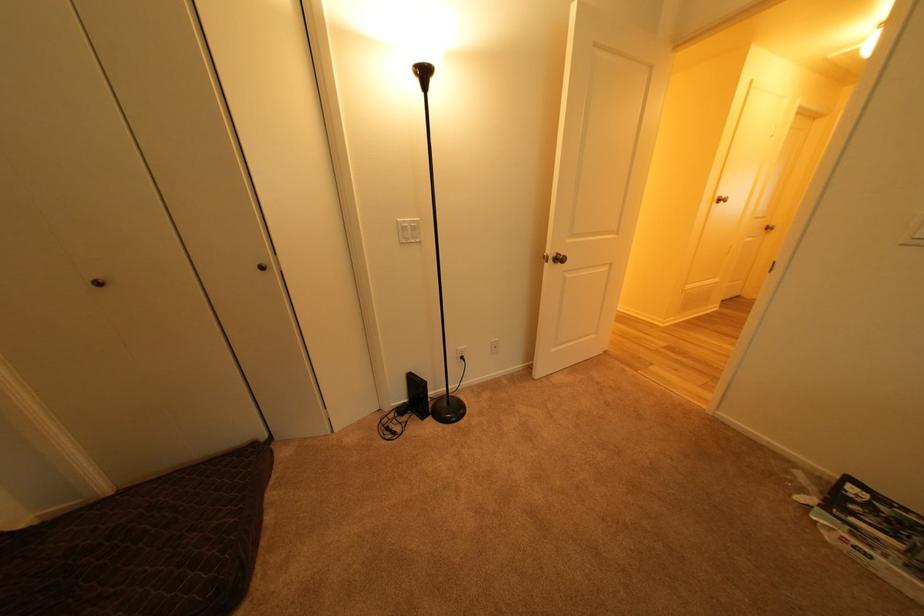
Find the location of a particular element. This screenshot has width=924, height=616. white light switch is located at coordinates (408, 230).